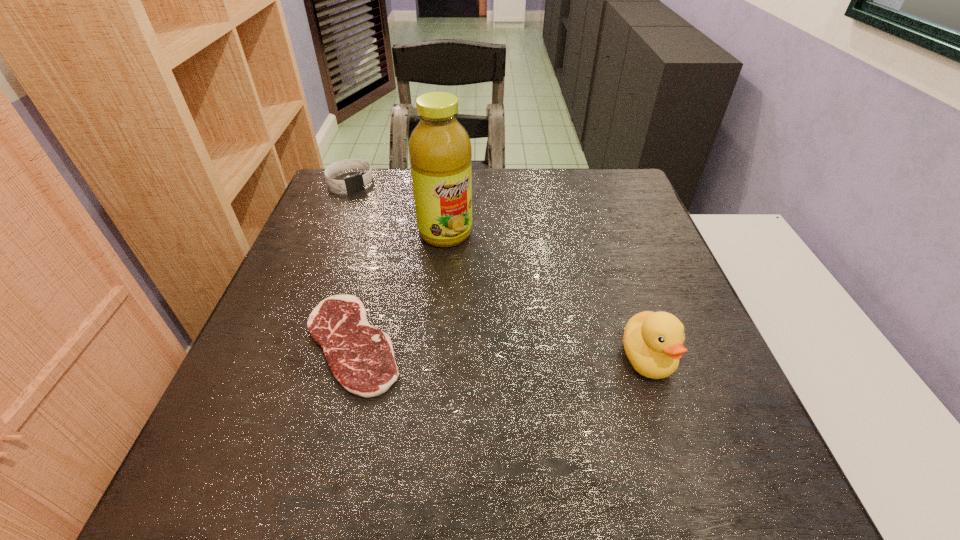
Find the location of `vacant space located on the front label of the tallest object`. vacant space located on the front label of the tallest object is located at coordinates (490, 292).

Where is `vacant space located on the front label of the tallest object`? The image size is (960, 540). vacant space located on the front label of the tallest object is located at coordinates (475, 273).

At what (x,y) coordinates should I click in order to perform the action: click on free spot located 0.210m on the outer surface of the farthest object. Please return your answer as a coordinate pair (x, y). The image size is (960, 540). Looking at the image, I should click on (383, 231).

Where is `free region located 0.200m on the outer surface of the farthest object`? The height and width of the screenshot is (540, 960). free region located 0.200m on the outer surface of the farthest object is located at coordinates (382, 228).

Image resolution: width=960 pixels, height=540 pixels. Identify the location of free spot located 0.290m on the outer surface of the farthest object. tap(395, 247).

Where is `object that is at the far edge`? This screenshot has width=960, height=540. object that is at the far edge is located at coordinates (356, 182).

This screenshot has width=960, height=540. Identify the location of object that is positioned at the near edge. (361, 357).

Where is `steak situated at the left edge`? Image resolution: width=960 pixels, height=540 pixels. steak situated at the left edge is located at coordinates (361, 357).

What are the coordinates of `wristband at the left edge` in the screenshot? It's located at (356, 182).

You are a GUI agent. You are given a task and a screenshot of the screen. Output one action in this format:
    pyautogui.click(x=<x>, y=<y>)
    Task: Click on the object situated at the right edge
    This screenshot has height=540, width=960.
    Given the screenshot: What is the action you would take?
    pyautogui.click(x=653, y=341)